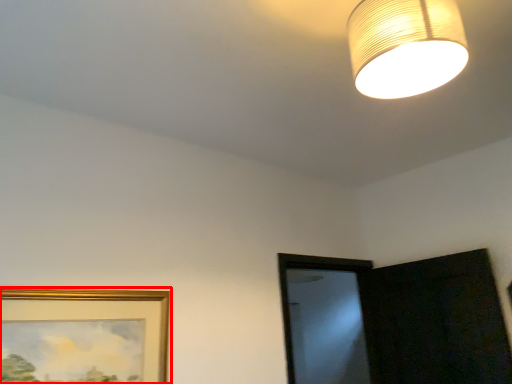
Question: Observing the image, what is the correct spatial positioning of picture frame (annotated by the red box) in reference to lamp?

Choices:
 (A) left
 (B) right

Answer: (A)